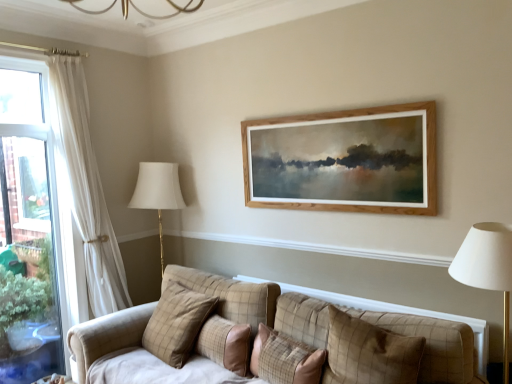
Question: From the image's perspective, relative to plaid fabric pillow at center, the second pillow when ordered from left to right, is plaid fabric pillow at center, acting as the 1th pillow starting from the left, above or below?

Choices:
 (A) below
 (B) above

Answer: (B)

Question: Visually, is plaid fabric pillow at center, acting as the 1th pillow starting from the left, positioned to the left or to the right of plaid fabric pillow at center, the second pillow when ordered from left to right?

Choices:
 (A) left
 (B) right

Answer: (A)

Question: Which object is the closest to the plaid fabric pillow at center, which is the second pillow from right to left?

Choices:
 (A) plaid fabric pillow at center, acting as the 1th pillow starting from the left
 (B) plaid fabric pillow at center, which ranks as the 4th pillow in left-to-right order
 (C) plaid fabric pillow at center, the second pillow when ordered from left to right

Answer: (C)

Question: Based on their relative distances, which object is nearer to the plaid fabric pillow at center, which is counted as the fourth pillow, starting from the right?

Choices:
 (A) plaid fabric pillow at center, the second pillow when ordered from left to right
 (B) plaid fabric pillow at center, which ranks as the 4th pillow in left-to-right order
 (C) plaid fabric pillow at center, the third pillow viewed from the left

Answer: (A)